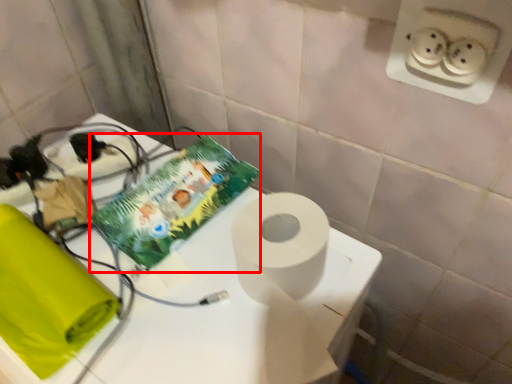
Question: Observing the image, what is the correct spatial positioning of comic book (annotated by the red box) in reference to table?

Choices:
 (A) left
 (B) right

Answer: (B)